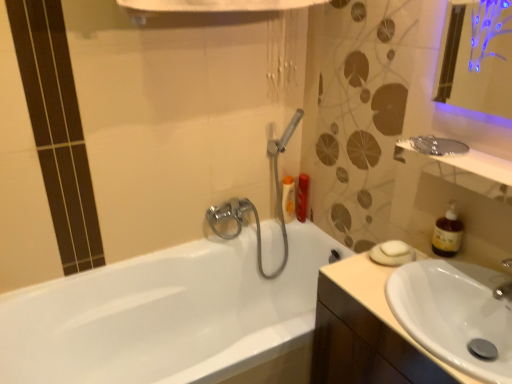
Question: Relative to white glossy bathtub at center, is metallic silver mirror at upper right in front or behind?

Choices:
 (A) behind
 (B) front

Answer: (A)

Question: From a real-world perspective, is metallic silver mirror at upper right above or below white glossy bathtub at center?

Choices:
 (A) below
 (B) above

Answer: (B)

Question: Which object is positioned farthest from the brown translucent soap dispenser at right?

Choices:
 (A) white matte soap at right
 (B) white glossy sink at lower right
 (C) orange matte bottle at upper right, the first toiletry when ordered from left to right
 (D) metallic silver mirror at upper right
 (E) white glossy bathtub at center

Answer: (E)

Question: Which object is positioned farthest from the white glossy bathtub at center?

Choices:
 (A) metallic silver mirror at upper right
 (B) beige wood cabinet at lower right
 (C) white glossy sink at lower right
 (D) brown translucent soap dispenser at right
 (E) white matte soap at right

Answer: (D)